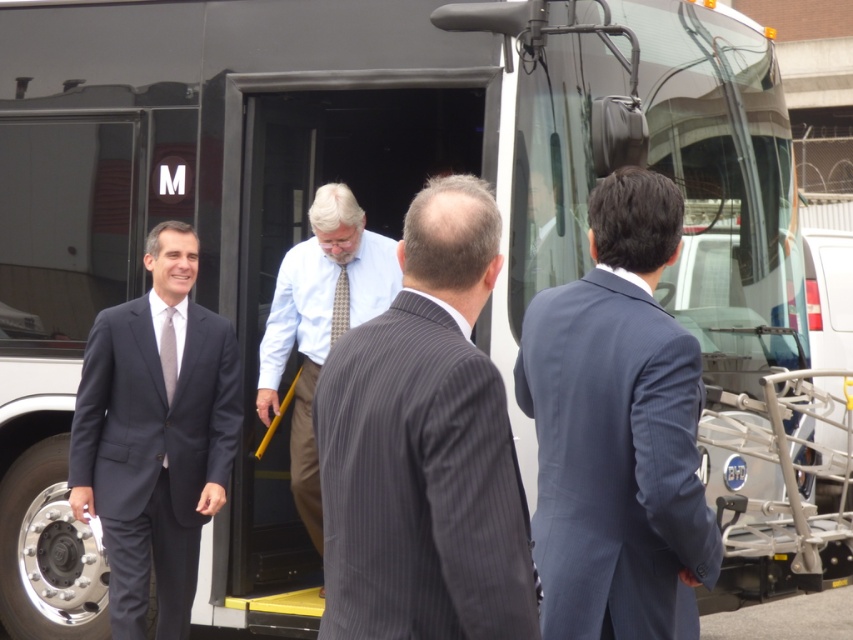
You are a photographer at a corporate event and need to ensure that both the blue pinstripe suit at center and the light blue shirt with tie at center are clearly visible in your photo. Given their sizes, which one might you need to adjust your camera focus on to ensure it doesn

The blue pinstripe suit at center has a smaller size compared to light blue shirt with tie at center. To ensure both are clearly visible, you should focus on the smaller blue pinstripe suit at center to avoid it appearing too small in the photo.

You are a photographer at the scene and need to capture a photo that includes both the blue pinstripe suit at center and the dark blue suit at left. Given that your camera has a maximum focus range of 7 feet, will you be able to fit both subjects into the frame without moving closer or farther away?

The blue pinstripe suit at center and dark blue suit at left are 7.76 feet apart from each other, which exceeds the camera maximum focus range of 7 feet. Therefore, you won t be able to fit both subjects into the frame without adjusting your position.